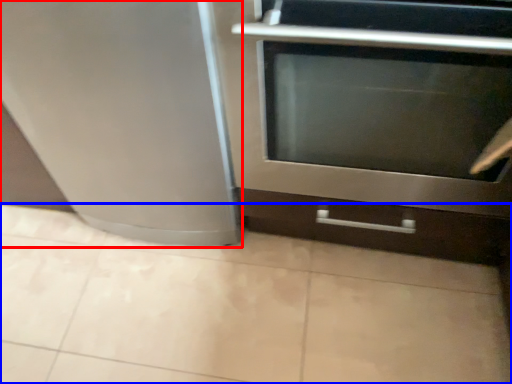
Question: Which point is further to the camera, appliance (highlighted by a red box) or ceramic tile (highlighted by a blue box)?

Choices:
 (A) appliance
 (B) ceramic tile

Answer: (B)